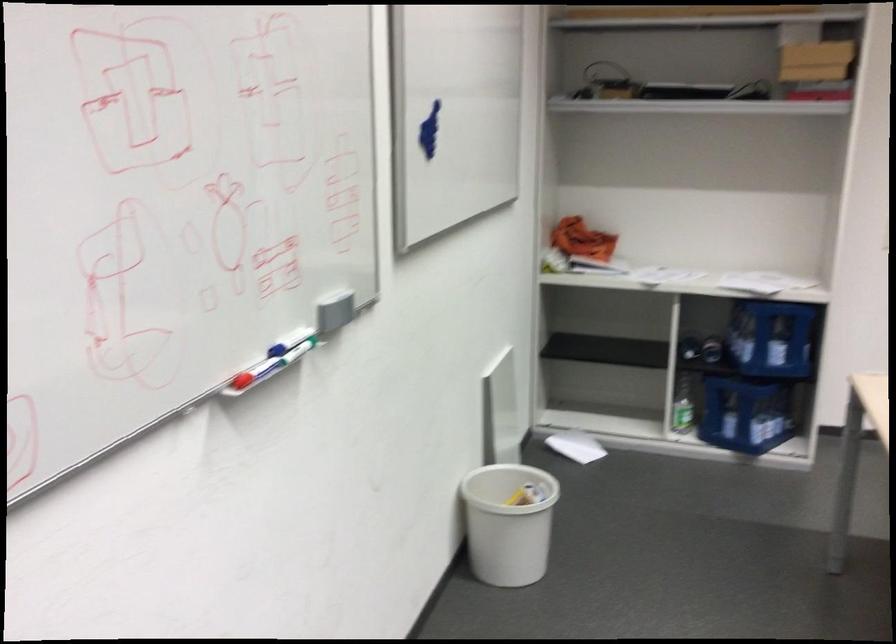
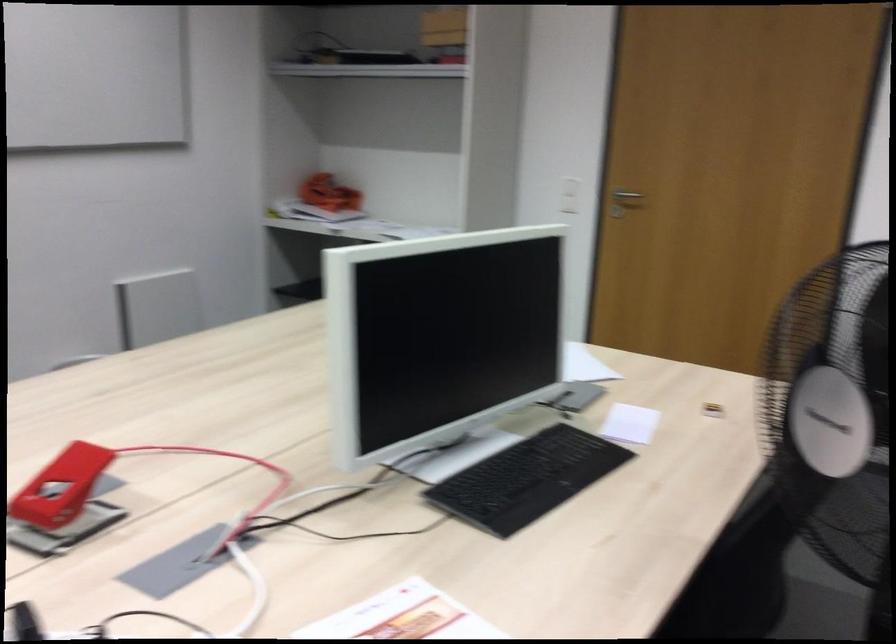
Question: What movement of the cameraman would produce the second image?

Choices:
 (A) Left
 (B) Right
 (C) Forward
 (D) Backward

Answer: (B)